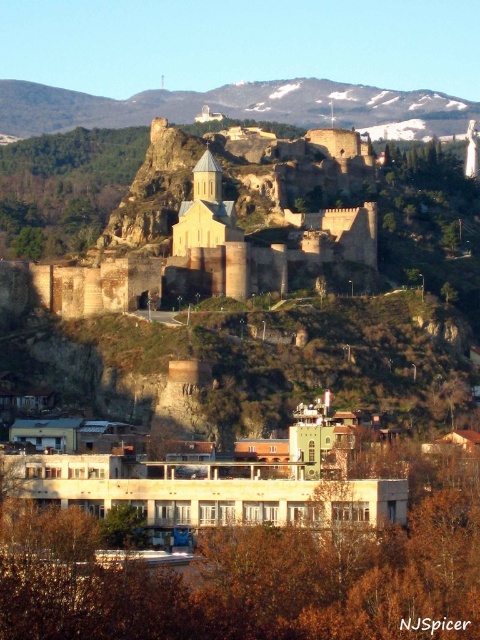
Is brown stone castle at upper center wider than snowy rocky mountain at upper center?

No.

Which is behind, point (142, 262) or point (374, 88)?

The point (374, 88) is behind.

Locate an element on the screen. Image resolution: width=480 pixels, height=640 pixels. brown stone castle at upper center is located at coordinates (214, 253).